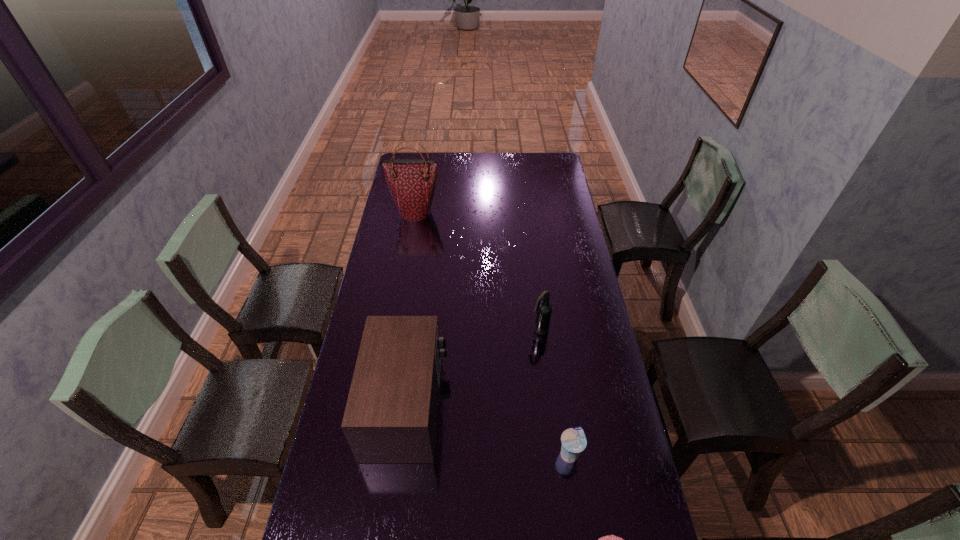
Where is `free space between the handbag and the beer bottle`? The image size is (960, 540). free space between the handbag and the beer bottle is located at coordinates (477, 271).

This screenshot has width=960, height=540. Identify the location of unoccupied position between the yogurt and the radio receiver. (489, 429).

Where is `free space that is in between the tallest object and the radio receiver`? free space that is in between the tallest object and the radio receiver is located at coordinates (412, 308).

Find the location of a particular element. This screenshot has width=960, height=540. the second closest object relative to the fourth tallest object is located at coordinates [x=391, y=413].

Identify which object is located as the nearest to the shortest object. Please provide its 2D coordinates. Your answer should be formatted as a tuple, i.e. [(x, y)], where the tuple contains the x and y coordinates of a point satisfying the conditions above.

[(573, 440)]

This screenshot has height=540, width=960. In order to click on free location that satisfies the following two spatial constraints: 1. on the front-facing side of the fourth tallest object; 2. on the right side of the radio receiver in this screenshot , I will do `click(401, 454)`.

Identify the location of vacant area in the image that satisfies the following two spatial constraints: 1. on the front side of the fourth tallest object; 2. on the right side of the second farthest object. (555, 454).

The height and width of the screenshot is (540, 960). What are the coordinates of `free space in the image that satisfies the following two spatial constraints: 1. on the front-facing side of the yogurt; 2. on the right side of the radio receiver` in the screenshot? It's located at (x=401, y=454).